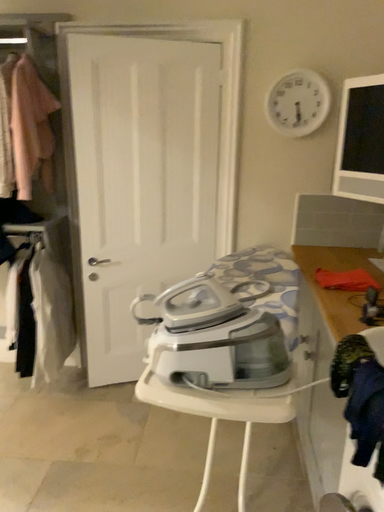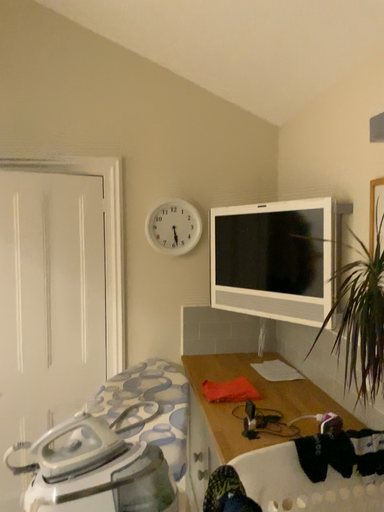
Question: Which way did the camera rotate in the video?

Choices:
 (A) rotated left
 (B) rotated right

Answer: (B)